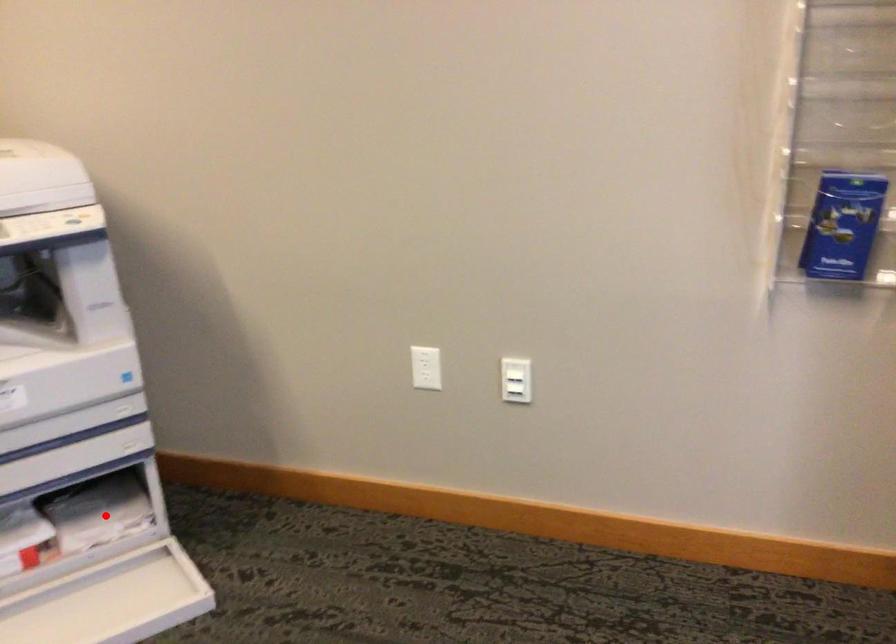
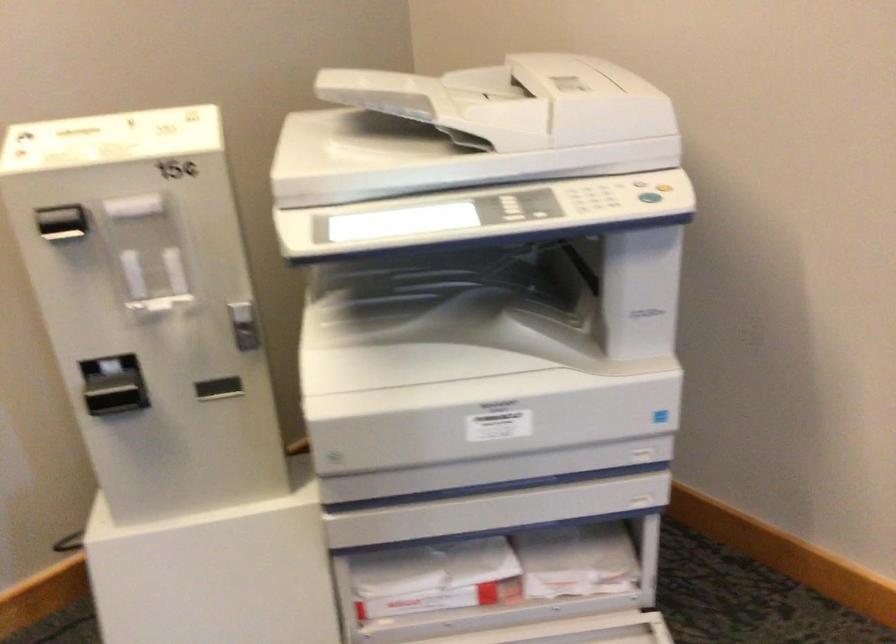
Question: I am providing you with two images of the same scene from different viewpoints. Image1 has a red point marked. In image2, the corresponding 3D location appears at what relative position? Reply with the corresponding letter.

Choices:
 (A) Closer
 (B) Farther

Answer: (A)